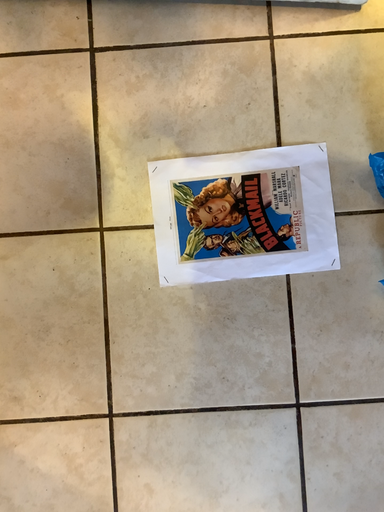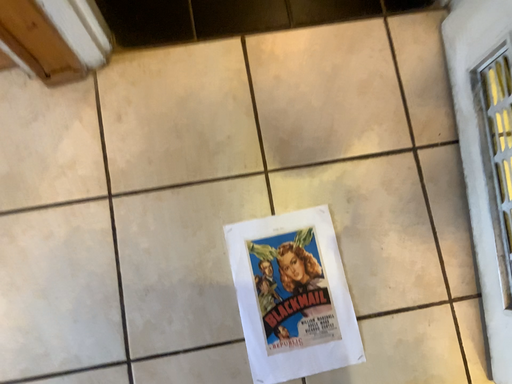
Question: How did the camera likely rotate when shooting the video?

Choices:
 (A) rotated downward
 (B) rotated upward

Answer: (B)